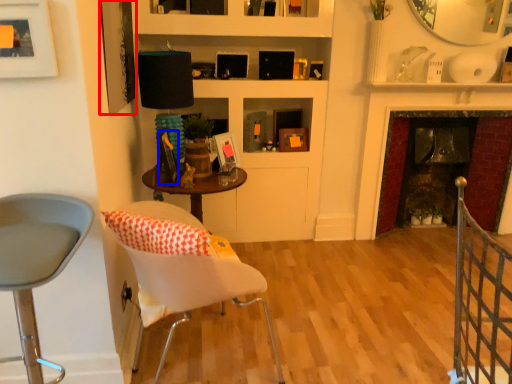
Question: Which object is further to the camera taking this photo, picture frame (highlighted by a red box) or picture frame (highlighted by a blue box)?

Choices:
 (A) picture frame
 (B) picture frame

Answer: (B)